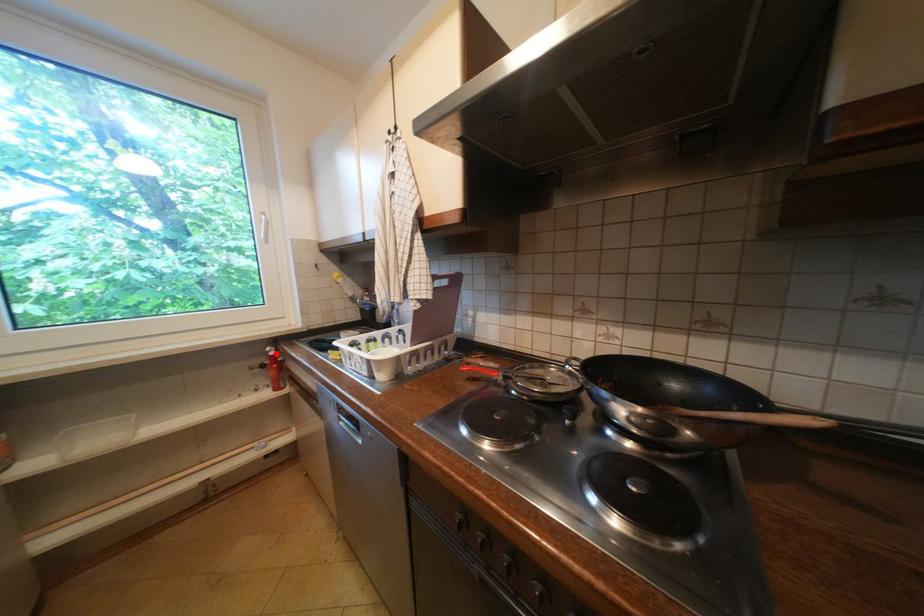
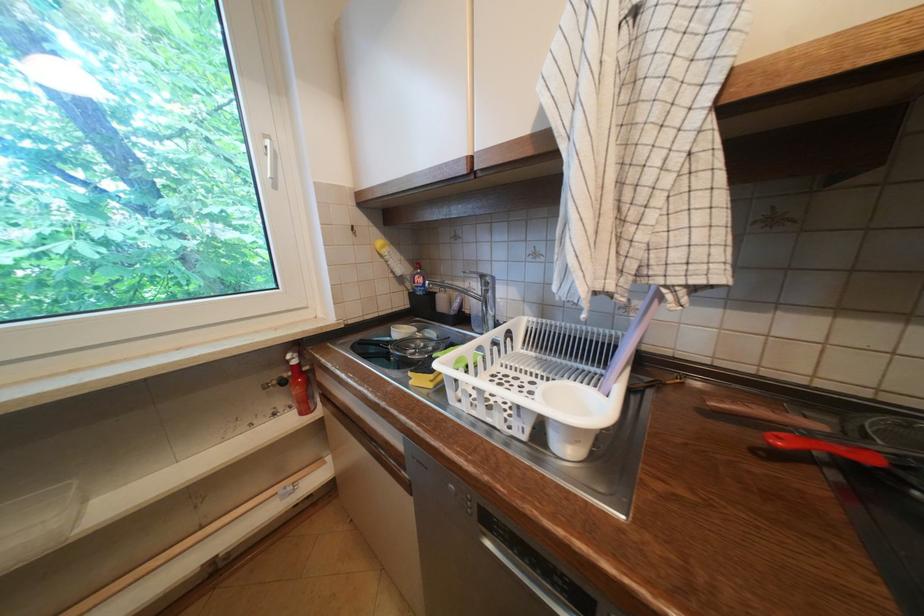
Find the pixel in the second image that matches the highlighted location in the first image.

(296, 362)